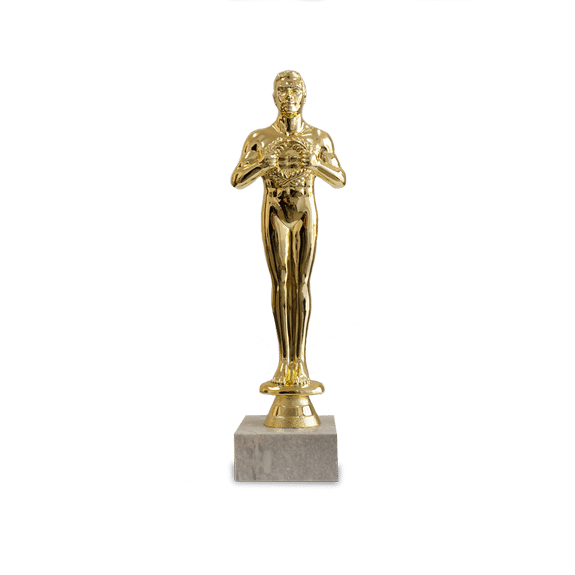
Locate an element on the screen. This screenshot has height=575, width=575. wreath is located at coordinates (293, 182).